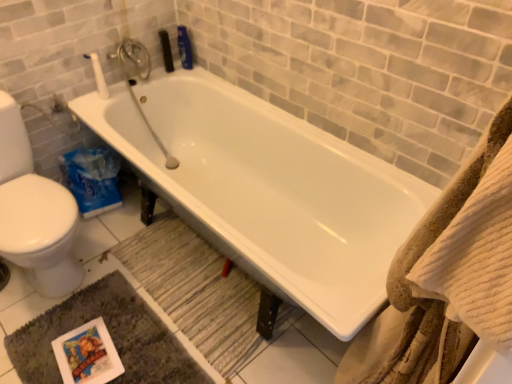
You are a GUI agent. You are given a task and a screenshot of the screen. Output one action in this format:
    pyautogui.click(x=<x>, y=<y>)
    Task: Click on the vacant area on the back side of dark gray plush bath mat at lower left, which ranks as the second bath mat in top-to-bottom order
    Image resolution: width=512 pixels, height=384 pixels.
    Given the screenshot: What is the action you would take?
    pyautogui.click(x=151, y=252)